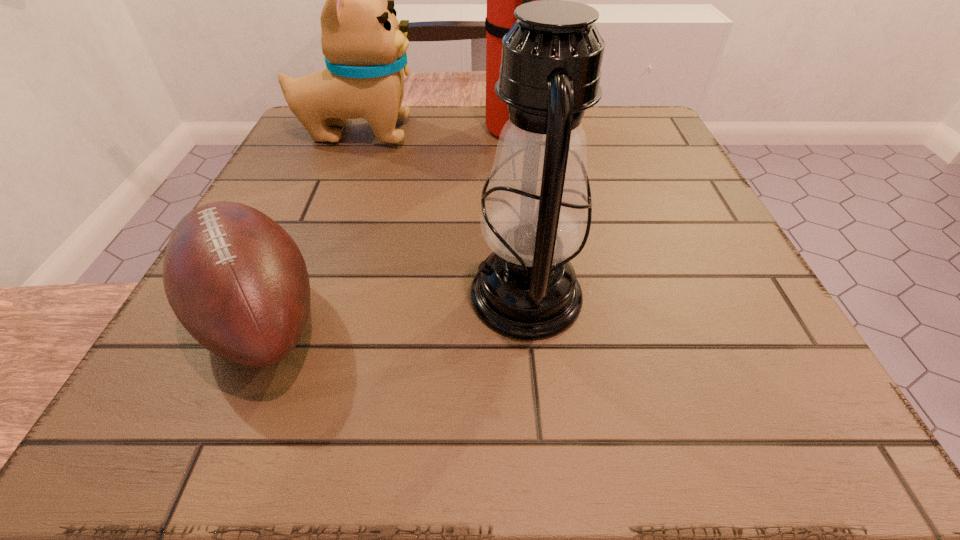
The width and height of the screenshot is (960, 540). In order to click on the tallest object in this screenshot , I will do `click(502, 0)`.

Where is `oil lamp`? Image resolution: width=960 pixels, height=540 pixels. oil lamp is located at coordinates (536, 215).

The image size is (960, 540). In order to click on puppy in this screenshot , I will do `click(364, 45)`.

The image size is (960, 540). I want to click on the shortest object, so click(236, 280).

The image size is (960, 540). I want to click on vacant area situated 0.070m at the nozzle of the fire extinguisher, so click(x=455, y=130).

Find the location of a particular element. This screenshot has height=540, width=960. blank space located 0.210m at the nozzle of the fire extinguisher is located at coordinates (395, 130).

Identify the location of vacant region located 0.350m at the nozzle of the fire extinguisher. (335, 130).

You are a GUI agent. You are given a task and a screenshot of the screen. Output one action in this format:
    pyautogui.click(x=<x>, y=<y>)
    Task: Click on the free space located on the back of the oil lamp
    The height and width of the screenshot is (540, 960).
    Given the screenshot: What is the action you would take?
    pyautogui.click(x=510, y=133)

Find the location of `free space located on the face of the puppy`. free space located on the face of the puppy is located at coordinates (579, 132).

At what (x,y) coordinates should I click in order to perform the action: click on free location located on the right of the football (American). Please return your answer as a coordinate pair (x, y). This screenshot has width=960, height=540. Looking at the image, I should click on (442, 316).